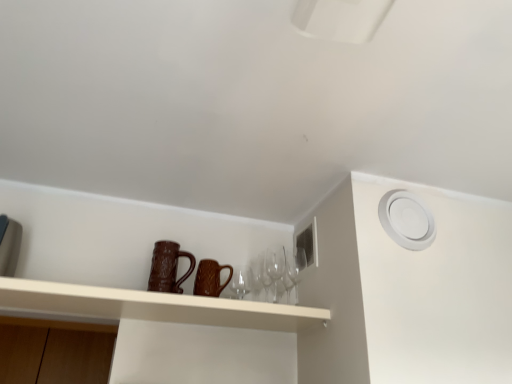
You are a GUI agent. You are given a task and a screenshot of the screen. Output one action in this format:
    pyautogui.click(x=<x>, y=<y>)
    Task: Click on the vacant space to the left of transparent glass wine glass at center, the second wine glass when ordered from left to right
    
    Given the screenshot: What is the action you would take?
    pyautogui.click(x=251, y=317)